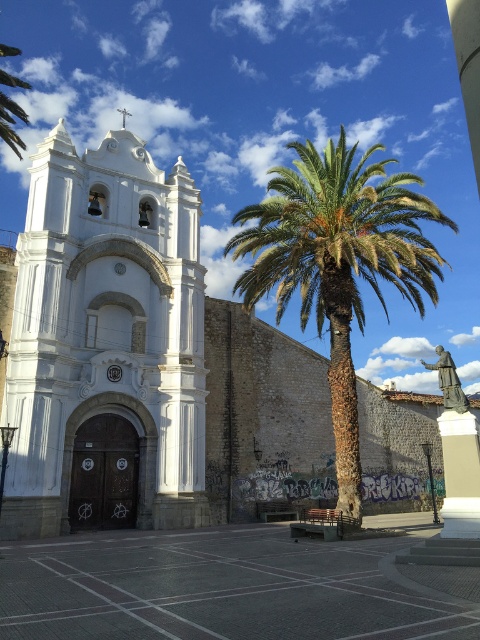
You are planning to place a large statue in the gray concrete plaza at center. Considering the size of the plaza, will it fit comfortably without overcrowding the space? Please refer to the green leafy palm at center for spatial context.

The gray concrete plaza at center is smaller than the green leafy palm at center, so placing a large statue there may overcrowd the space as the plaza is not large enough to accommodate it comfortably.

You are planning to build a small garden between the white stone church at center and the gray concrete plaza at center. Considering their sizes, which one has more space available for the garden?

The gray concrete plaza at center has more space available for the garden because the white stone church at center is wider, leaving less room between them.

You are a visitor standing in front of the church and want to take a photo that includes both the gray concrete plaza at center and the green leafy palm at center. Which object will appear taller in the photo?

The green leafy palm at center will appear taller in the photo because it is taller than the gray concrete plaza at center.